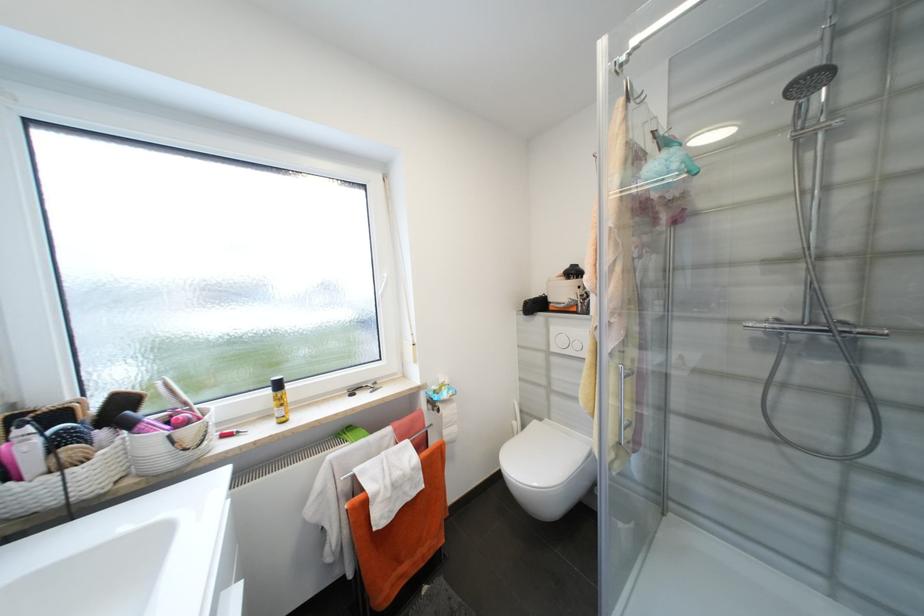
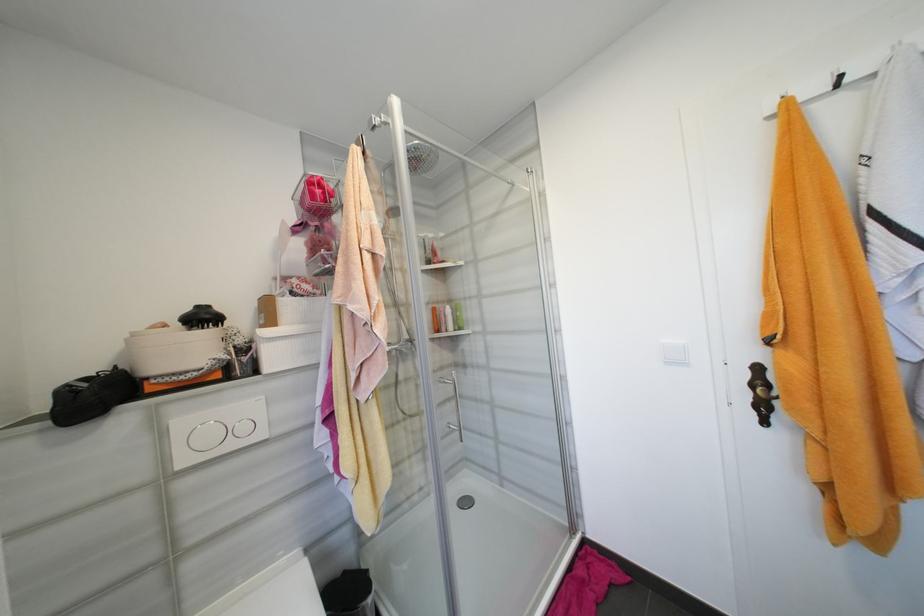
Locate, in the second image, the point that corresponds to (x=579, y=274) in the first image.

(210, 318)